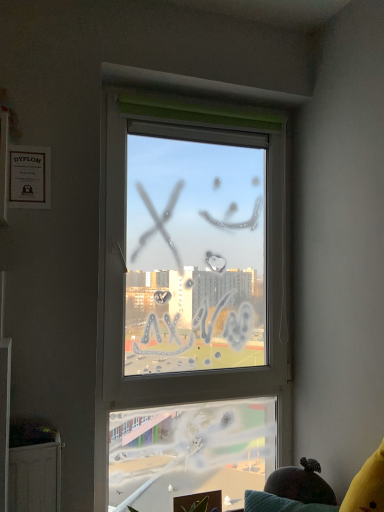
At what (x,y) coordinates should I click in order to perform the action: click on transparent glass window at center. Please return your answer as a coordinate pair (x, y). The height and width of the screenshot is (512, 384). Looking at the image, I should click on (191, 289).

The height and width of the screenshot is (512, 384). What do you see at coordinates (191, 289) in the screenshot?
I see `transparent glass window at center` at bounding box center [191, 289].

What is the approximate height of transparent glass window at center?

transparent glass window at center is 5.71 feet tall.

The height and width of the screenshot is (512, 384). I want to click on velvet yellow couch at lower right, so click(x=343, y=499).

What do you see at coordinates (343, 499) in the screenshot? The image size is (384, 512). I see `velvet yellow couch at lower right` at bounding box center [343, 499].

This screenshot has height=512, width=384. What are the coordinates of `transparent glass window at center` in the screenshot? It's located at (191, 289).

Is velvet yellow couch at lower right to the right of transparent glass window at center from the viewer's perspective?

Yes.

Is velvet yellow couch at lower right in front of or behind transparent glass window at center in the image?

velvet yellow couch at lower right is in front of transparent glass window at center.

Considering the positions of point (251, 511) and point (124, 170), is point (251, 511) closer or farther from the camera than point (124, 170)?

Point (251, 511).

From the image's perspective, between velvet yellow couch at lower right and transparent glass window at center, which one is located above?

From the image's view, transparent glass window at center is above.

From a real-world perspective, relative to transparent glass window at center, is velvet yellow couch at lower right vertically above or below?

Answer: velvet yellow couch at lower right is below transparent glass window at center.

Does velvet yellow couch at lower right have a greater width compared to transparent glass window at center?

Yes.

Considering the sizes of velvet yellow couch at lower right and transparent glass window at center in the image, is velvet yellow couch at lower right taller or shorter than transparent glass window at center?

Considering their sizes, velvet yellow couch at lower right has less height than transparent glass window at center.

Considering the sizes of velvet yellow couch at lower right and transparent glass window at center in the image, is velvet yellow couch at lower right bigger or smaller than transparent glass window at center?

Considering their sizes, velvet yellow couch at lower right takes up less space than transparent glass window at center.

Is velvet yellow couch at lower right spatially inside transparent glass window at center, or outside of it?

velvet yellow couch at lower right exists outside the volume of transparent glass window at center.

Is velvet yellow couch at lower right next to transparent glass window at center?

No, velvet yellow couch at lower right is not touching transparent glass window at center.

Is velvet yellow couch at lower right turned away from transparent glass window at center?

No, velvet yellow couch at lower right is not facing away from transparent glass window at center.

Can you tell me how much velvet yellow couch at lower right and transparent glass window at center differ in facing direction?

They differ by 40.3 degrees in their facing directions.

Locate an element on the screen. The image size is (384, 512). window that appears behind the velvet yellow couch at lower right is located at coordinates (191, 289).

Which object is positioned more to the left, transparent glass window at center or velvet yellow couch at lower right?

transparent glass window at center.

Is the position of transparent glass window at center less distant than that of velvet yellow couch at lower right?

No, the depth of transparent glass window at center is greater than that of velvet yellow couch at lower right.

Does point (118, 378) lie in front of point (289, 507)?

No, it is behind (289, 507).

From the image's perspective, does transparent glass window at center appear higher than velvet yellow couch at lower right?

Yes.

From a real-world perspective, is transparent glass window at center positioned above or below velvet yellow couch at lower right?

From a real-world perspective, transparent glass window at center is physically above velvet yellow couch at lower right.

Considering the sizes of objects transparent glass window at center and velvet yellow couch at lower right in the image provided, who is thinner, transparent glass window at center or velvet yellow couch at lower right?

transparent glass window at center.

Considering the sizes of objects transparent glass window at center and velvet yellow couch at lower right in the image provided, who is taller, transparent glass window at center or velvet yellow couch at lower right?

With more height is transparent glass window at center.

Based on the photo, considering the sizes of objects transparent glass window at center and velvet yellow couch at lower right in the image provided, who is smaller, transparent glass window at center or velvet yellow couch at lower right?

With smaller size is velvet yellow couch at lower right.

Is transparent glass window at center positioned beyond the bounds of velvet yellow couch at lower right?

Indeed, transparent glass window at center is completely outside velvet yellow couch at lower right.

Are transparent glass window at center and velvet yellow couch at lower right making contact?

No, transparent glass window at center is not in contact with velvet yellow couch at lower right.

Does transparent glass window at center turn towards velvet yellow couch at lower right?

Yes.

Can you tell me how much transparent glass window at center and velvet yellow couch at lower right differ in facing direction?

The angle between the facing direction of transparent glass window at center and the facing direction of velvet yellow couch at lower right is 40.3 degrees.

Locate an element on the screen. The width and height of the screenshot is (384, 512). window behind the velvet yellow couch at lower right is located at coordinates (191, 289).

Identify the location of window located above the velvet yellow couch at lower right (from a real-world perspective). (191, 289).

Where is `window on the left of velvet yellow couch at lower right`? window on the left of velvet yellow couch at lower right is located at coordinates (191, 289).